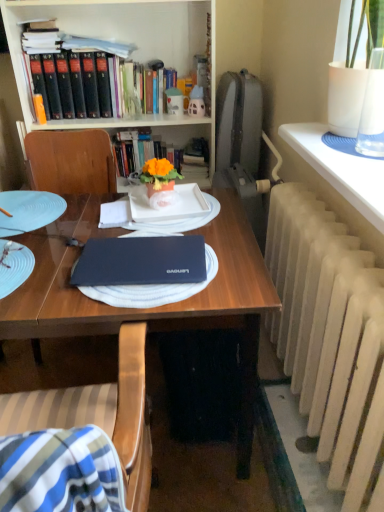
This screenshot has height=512, width=384. Find the location of `empty space that is ontop of matte black laptop at center (from a real-world perspective)`. empty space that is ontop of matte black laptop at center (from a real-world perspective) is located at coordinates (143, 252).